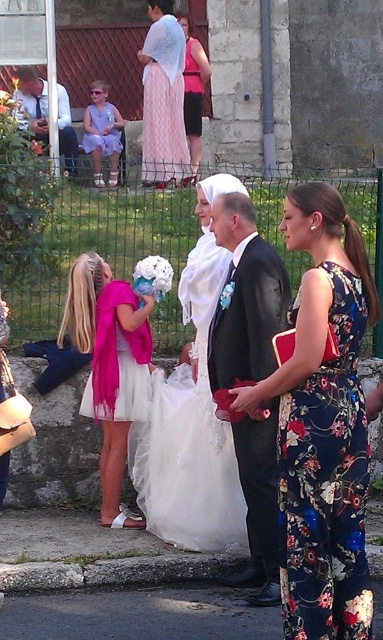
Is point (152, 304) farther from camera compared to point (114, 332)?

Yes, it is.

The image size is (383, 640). What do you see at coordinates (109, 368) in the screenshot?
I see `pink satin dress at lower left` at bounding box center [109, 368].

The height and width of the screenshot is (640, 383). Describe the element at coordinates (109, 368) in the screenshot. I see `pink satin dress at lower left` at that location.

In order to click on pink satin dress at lower left in this screenshot , I will do `click(109, 368)`.

Between point (255, 291) and point (114, 323), which one is positioned in front?

Point (255, 291)

At what (x,y) coordinates should I click in order to perform the action: click on shiny black suit at center. Please return your answer as a coordinate pair (x, y). Image resolution: width=383 pixels, height=640 pixels. Looking at the image, I should click on (245, 298).

The image size is (383, 640). Describe the element at coordinates (245, 298) in the screenshot. I see `shiny black suit at center` at that location.

At what (x,y) coordinates should I click in order to perform the action: click on shiny black suit at center. Please return your answer as a coordinate pair (x, y). This screenshot has height=640, width=383. Looking at the image, I should click on (245, 298).

Is shiny black suit at center bigger than pink satin dress at center?

Yes.

Is shiny black suit at center positioned in front of pink satin dress at center?

Yes.

Is point (268, 353) behind point (106, 358)?

No, (268, 353) is in front of (106, 358).

Locate an element on the screen. Image resolution: width=383 pixels, height=640 pixels. shiny black suit at center is located at coordinates (245, 298).